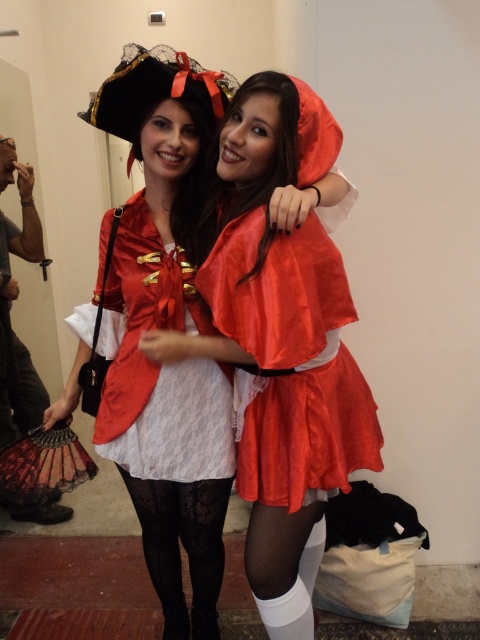
You are a photographer trying to capture a photo of the matte red dress at center and the black lace tights at lower center. Which object should you focus on first if you want to start with the one closer to the left side?

The matte red dress at center is to the left of black lace tights at lower center, so you should focus on the matte red dress at center first as it is closer to the left side.

You are a photographer setting up a shot of the two costumed individuals. You need to place a light source between the two points indicated by the coordinates point (316,486) and point (200,627). Which point should the light be closer to in order to ensure proper lighting on the subject closer to the viewer?

The light should be placed closer to point 0.761, 0660 because it is closer to the viewer than point (200,627). This will ensure the subject nearer to the viewer is properly lit.

You are a photographer setting up for a photoshoot. You need to position a spotlight at point coordinates of 0.5, 0.3. Where should you place the spotlight to ensure it illuminates the satin red dress at center?

The satin red dress at center is located at point coordinates of (162, 328), so you should place the spotlight at (144, 320) to illuminate it effectively since it is very close to the coordinates of the dress.